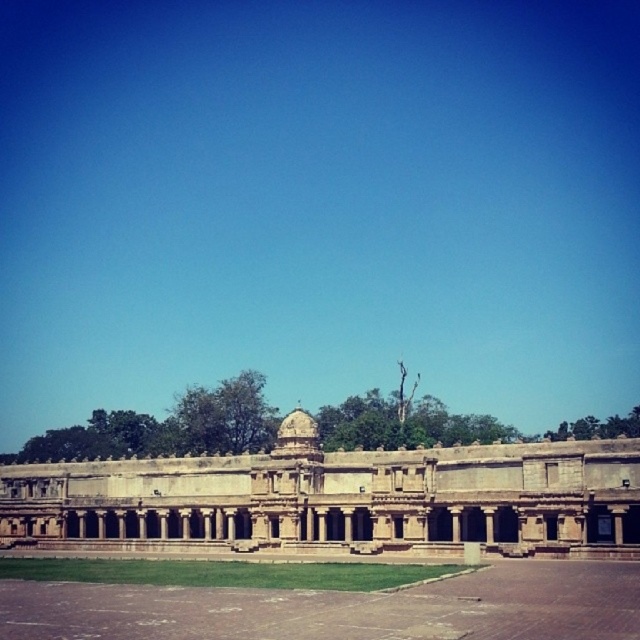
Does beige stone palace at center have a larger size compared to green grass at center?

Correct, beige stone palace at center is larger in size than green grass at center.

Between point (26, 538) and point (515, 561), which one is positioned in front?

Point (515, 561)

What are the coordinates of `beige stone palace at center` in the screenshot? It's located at (337, 499).